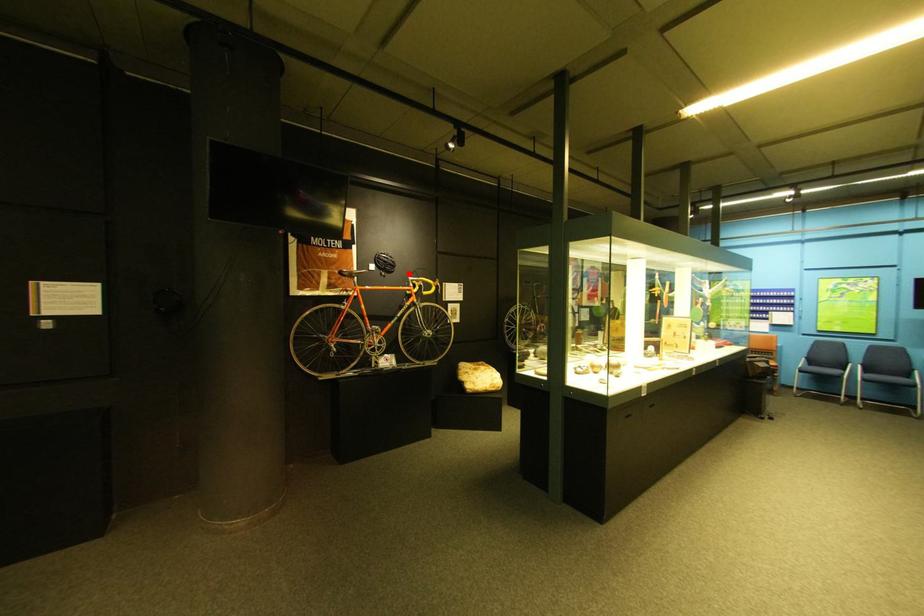
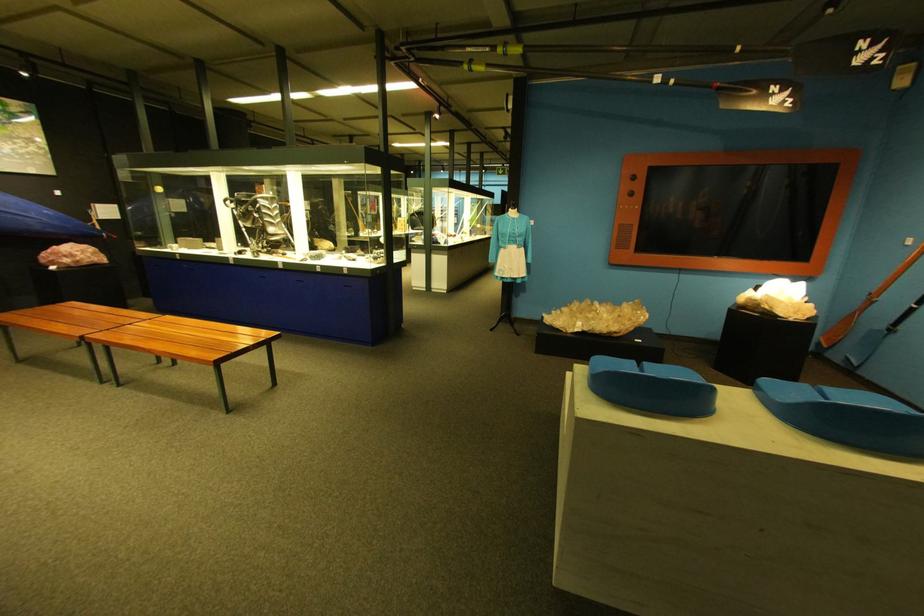
Question: I am providing you with two images of the same scene from different viewpoints. A red point is marked on the first image. At the location where the point appears in image 1, is it still visible in image 2?

Choices:
 (A) Yes
 (B) No

Answer: (B)